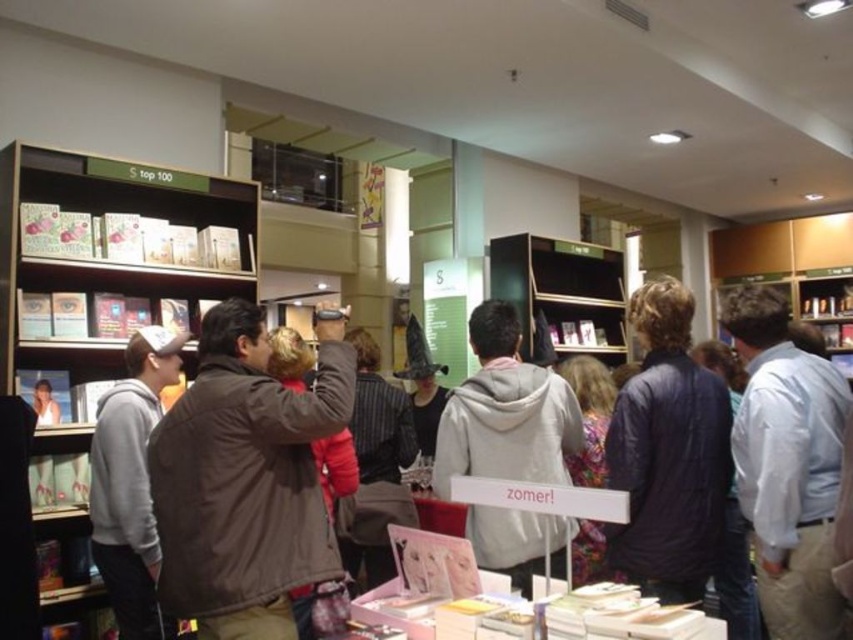
Where is `brown leather jacket at center`? The image size is (853, 640). brown leather jacket at center is located at coordinates (247, 477).

Where is `brown leather jacket at center`? Image resolution: width=853 pixels, height=640 pixels. brown leather jacket at center is located at coordinates (247, 477).

Is light blue shirt at center above dark blue jacket at center?

No, light blue shirt at center is not above dark blue jacket at center.

Between point (830, 419) and point (672, 458), which one is positioned behind?

Positioned behind is point (672, 458).

Is point (804, 586) less distant than point (650, 465)?

Yes, point (804, 586) is in front of point (650, 465).

The image size is (853, 640). Identify the location of light blue shirt at center. (787, 465).

The image size is (853, 640). What do you see at coordinates (668, 452) in the screenshot?
I see `dark blue jacket at center` at bounding box center [668, 452].

Between dark blue jacket at center and gray fleece jacket at left, which one is positioned higher?

dark blue jacket at center is higher up.

The width and height of the screenshot is (853, 640). What are the coordinates of `dark blue jacket at center` in the screenshot? It's located at (668, 452).